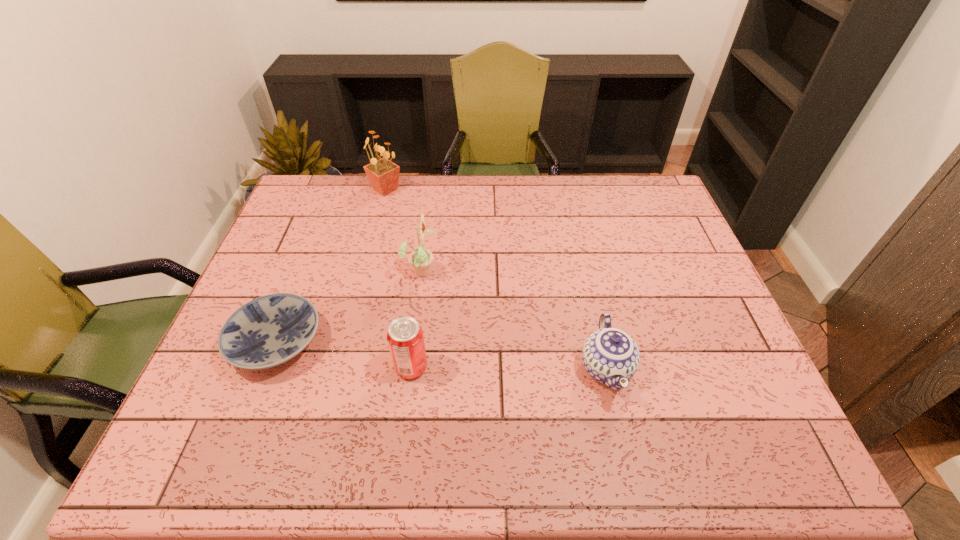
This screenshot has width=960, height=540. I want to click on blank area located on the front of the third tallest object, so click(405, 418).

You are a GUI agent. You are given a task and a screenshot of the screen. Output one action in this format:
    pyautogui.click(x=<x>, y=<y>)
    Task: Click on the vacant region located 0.080m at the spout of the rightmost object
    Image resolution: width=960 pixels, height=540 pixels.
    Given the screenshot: What is the action you would take?
    click(624, 446)

What are the coordinates of `vacant point located on the front of the shortest object` in the screenshot? It's located at (252, 407).

Locate an element on the screen. object at the far edge is located at coordinates (383, 174).

Identify the location of object that is at the left edge. The width and height of the screenshot is (960, 540). (268, 331).

Image resolution: width=960 pixels, height=540 pixels. I want to click on free space at the far edge of the desktop, so click(x=527, y=206).

This screenshot has width=960, height=540. In the image, there is a desktop. What are the coordinates of `vacant space at the near edge` in the screenshot? It's located at click(552, 458).

The image size is (960, 540). I want to click on vacant space at the left edge, so click(x=213, y=421).

This screenshot has height=540, width=960. In the image, there is a desktop. What are the coordinates of `free space at the far right corner` in the screenshot? It's located at pyautogui.click(x=650, y=176).

Find the location of a particular element. free space between the third shortest object and the shortest object is located at coordinates (344, 355).